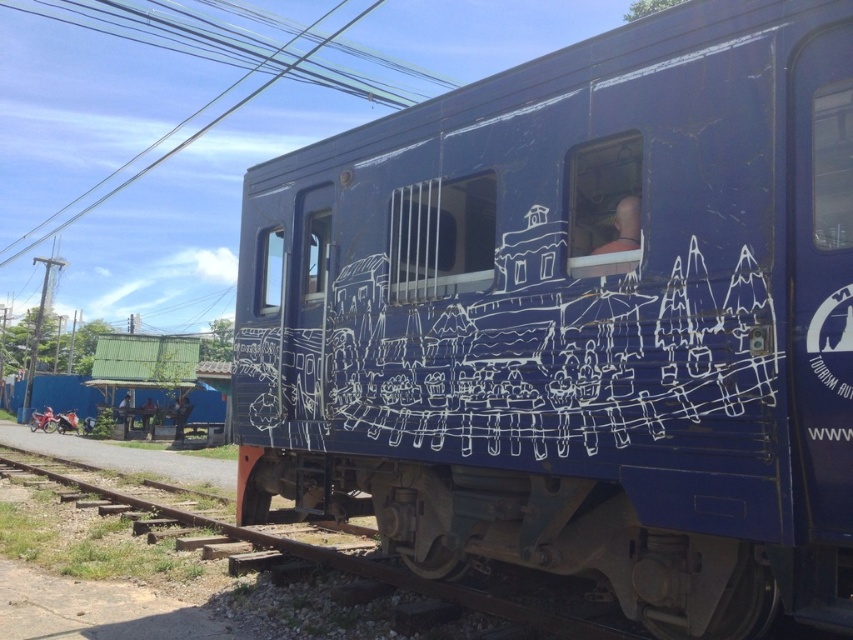
This screenshot has height=640, width=853. What do you see at coordinates (578, 320) in the screenshot?
I see `blue matte train at center` at bounding box center [578, 320].

Locate an element on the screen. blue matte train at center is located at coordinates [578, 320].

The height and width of the screenshot is (640, 853). What do you see at coordinates (578, 320) in the screenshot?
I see `blue matte train at center` at bounding box center [578, 320].

Image resolution: width=853 pixels, height=640 pixels. Identify the location of blue matte train at center. (578, 320).

What do you see at coordinates (509, 358) in the screenshot?
I see `white chalk drawing at center` at bounding box center [509, 358].

Does point (281, 381) come closer to viewer compared to point (450, 592)?

No, it is behind (450, 592).

Image resolution: width=853 pixels, height=640 pixels. Identify the location of white chalk drawing at center. (509, 358).

Can you confirm if blue matte train at center is smaller than metal/rough track at lower center?

Correct, blue matte train at center occupies less space than metal/rough track at lower center.

Who is more forward, (787,566) or (326,550)?

Point (787,566)

Between point (415, 284) and point (84, 483), which one is positioned in front?

Positioned in front is point (415, 284).

I want to click on blue matte train at center, so click(578, 320).